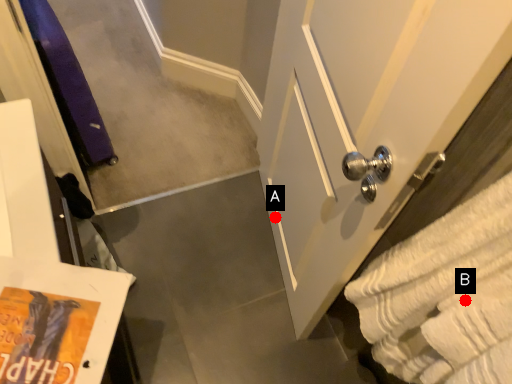
Question: Two points are circled on the image, labeled by A and B beside each circle. Which point is further to the camera?

Choices:
 (A) A is further
 (B) B is further

Answer: (A)